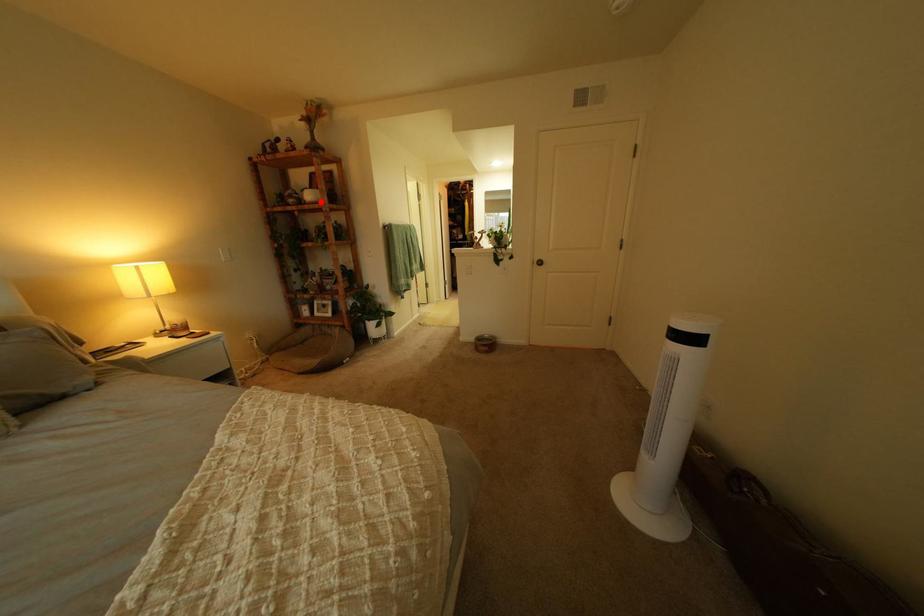
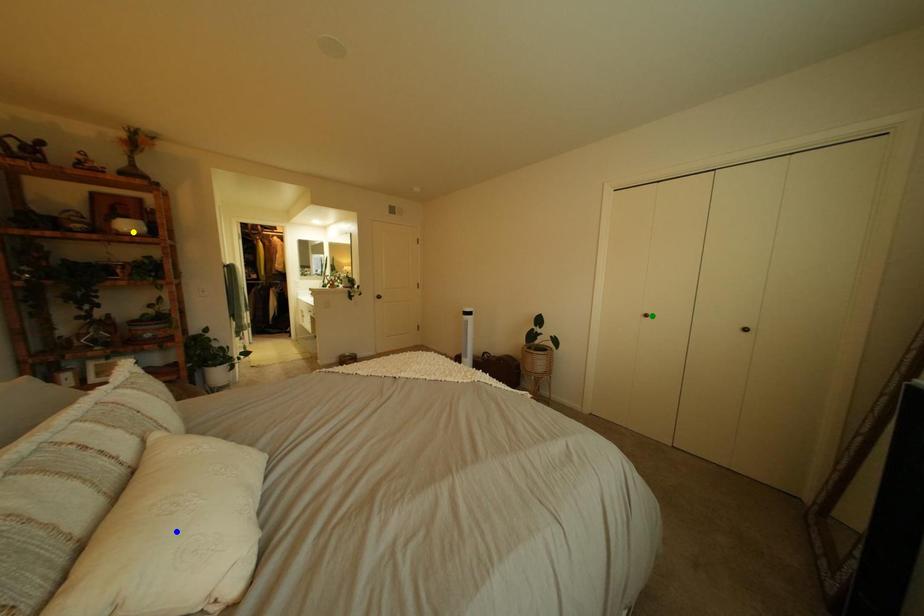
Question: I am providing you with two images of the same scene from different viewpoints. A red point is marked on the first image. You are given multiple points on the second image. Which point in image 2 is actually the same real-world point as the red point in image 1?

Choices:
 (A) yellow point
 (B) green point
 (C) blue point

Answer: (A)